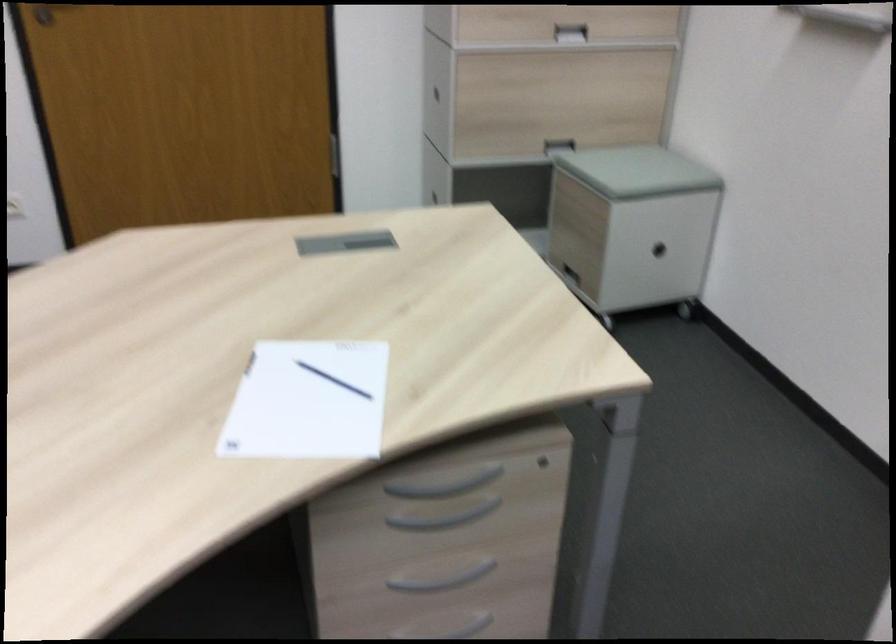
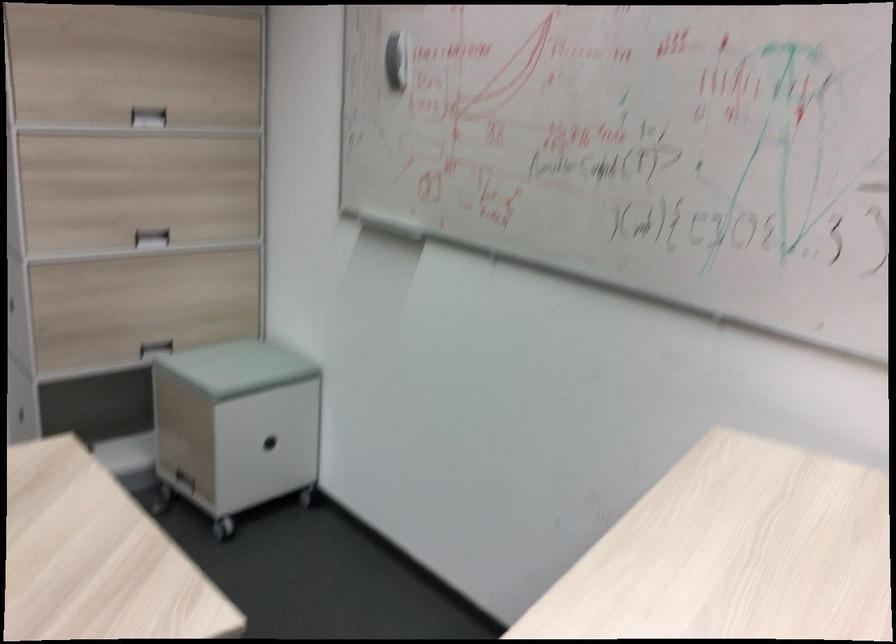
The images are taken continuously from a first-person perspective. In which direction are you moving?

The cameraman moved toward right, backward.